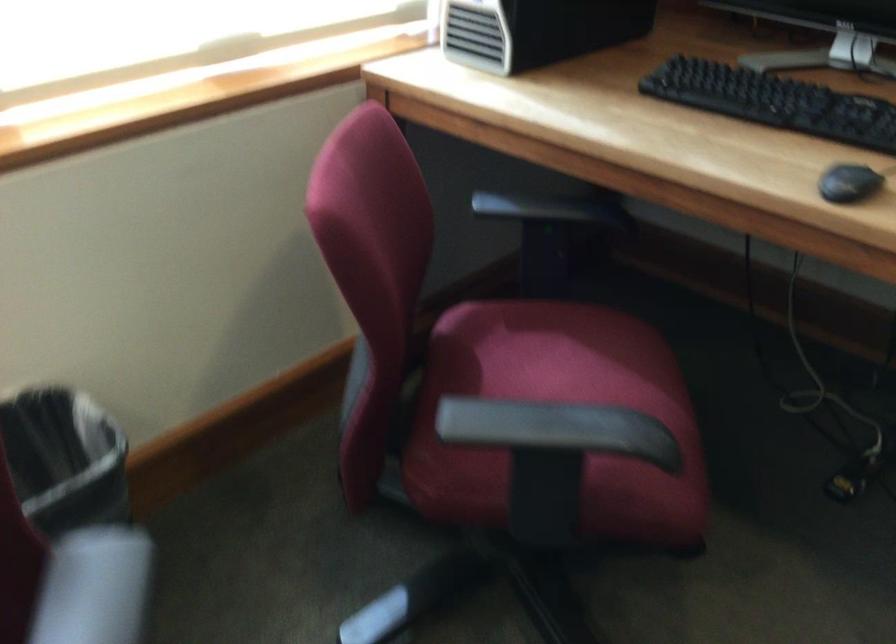
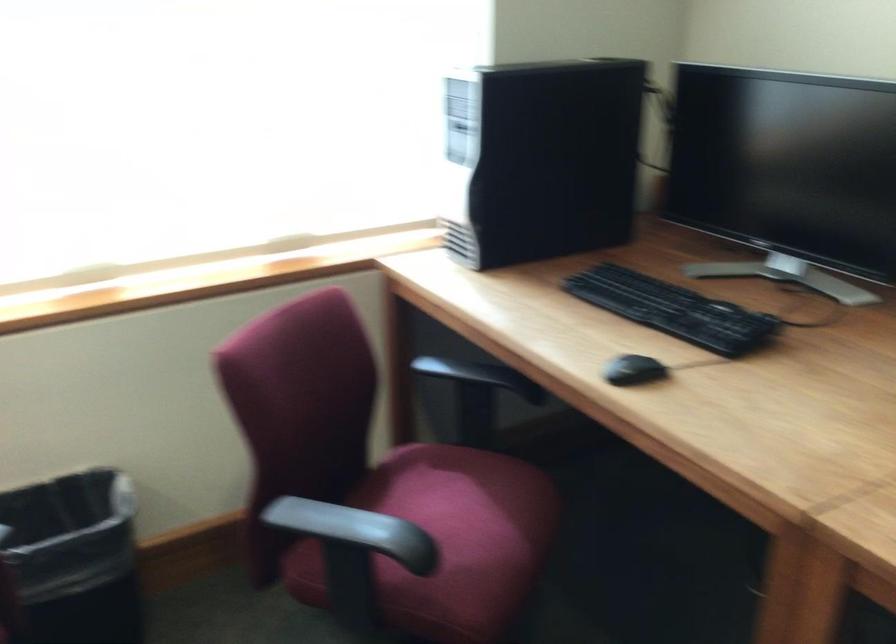
What movement of the cameraman would produce the second image?

The movement direction of the cameraman is right, backward.